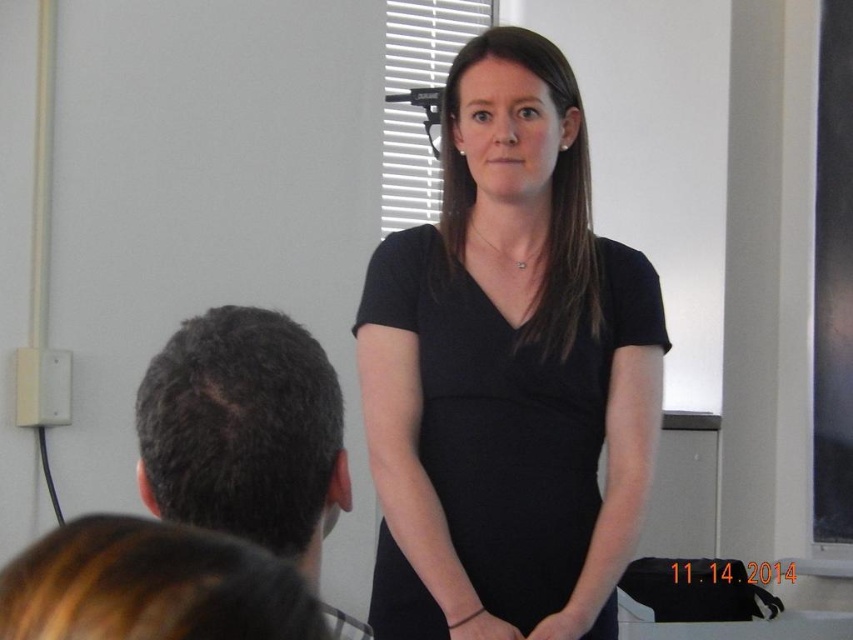
Based on the photo, you are a photographer setting up for a portrait. You see the black matte dress at center and the dark brown hair at left in the frame. Which object is positioned higher in the image?

The black matte dress at center is located above the dark brown hair at left, so it is positioned higher in the image.